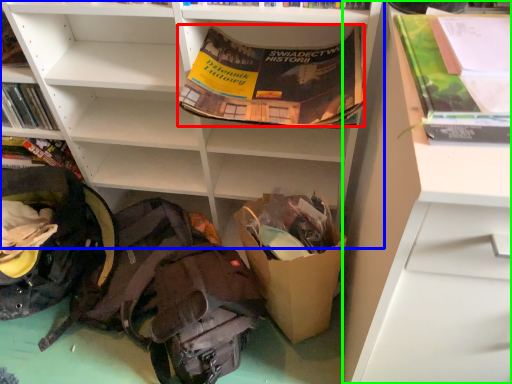
Question: Considering the real-world distances, which object is closest to paperback book (highlighted by a red box)? shelf (highlighted by a blue box) or shelf (highlighted by a green box).

Choices:
 (A) shelf
 (B) shelf

Answer: (A)